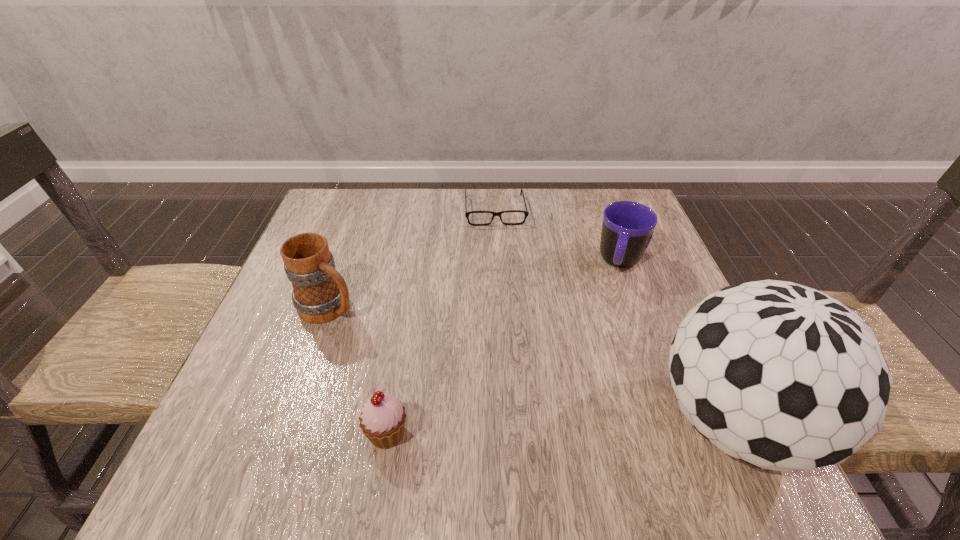
Image resolution: width=960 pixels, height=540 pixels. In order to click on free spot on the desktop that is between the cupcake and the soccer ball and is positioned on the side of the leftmost object with the handle in this screenshot , I will do `click(532, 428)`.

This screenshot has width=960, height=540. Find the location of `vacant space on the desktop that is between the second object from left to right and the soccer ball and is positioned on the front-facing side of the shortest object`. vacant space on the desktop that is between the second object from left to right and the soccer ball and is positioned on the front-facing side of the shortest object is located at coordinates (520, 429).

Find the location of a particular element. vacant spot on the desktop that is between the cupcake and the tallest object and is positioned with the handle on the side of the second farthest object is located at coordinates (574, 427).